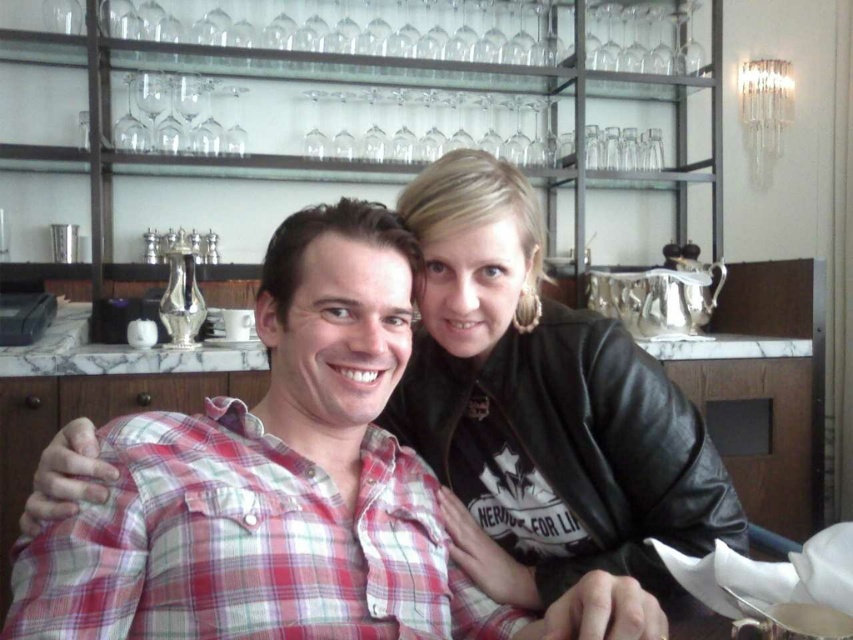
Question: Does plaid cotton shirt at center have a lesser width compared to black leather jacket at upper right?

Choices:
 (A) yes
 (B) no

Answer: (B)

Question: Among these points, which one is nearest to the camera?

Choices:
 (A) (538, 404)
 (B) (383, 384)

Answer: (B)

Question: Does plaid cotton shirt at center appear under black leather jacket at upper right?

Choices:
 (A) no
 (B) yes

Answer: (A)

Question: Can you confirm if plaid cotton shirt at center is wider than black leather jacket at upper right?

Choices:
 (A) yes
 (B) no

Answer: (A)